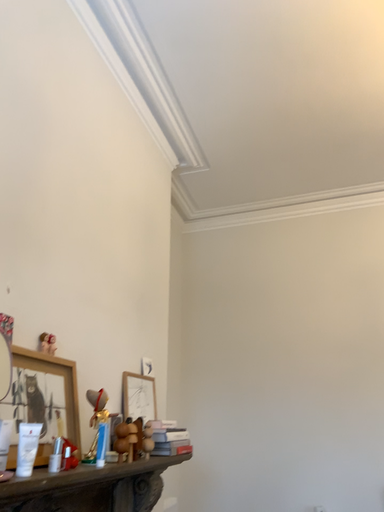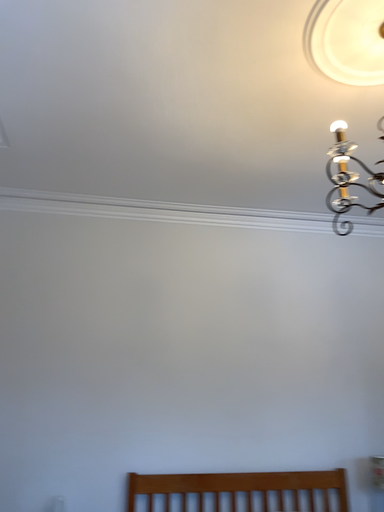
Question: Which way did the camera rotate in the video?

Choices:
 (A) rotated left
 (B) rotated right

Answer: (B)